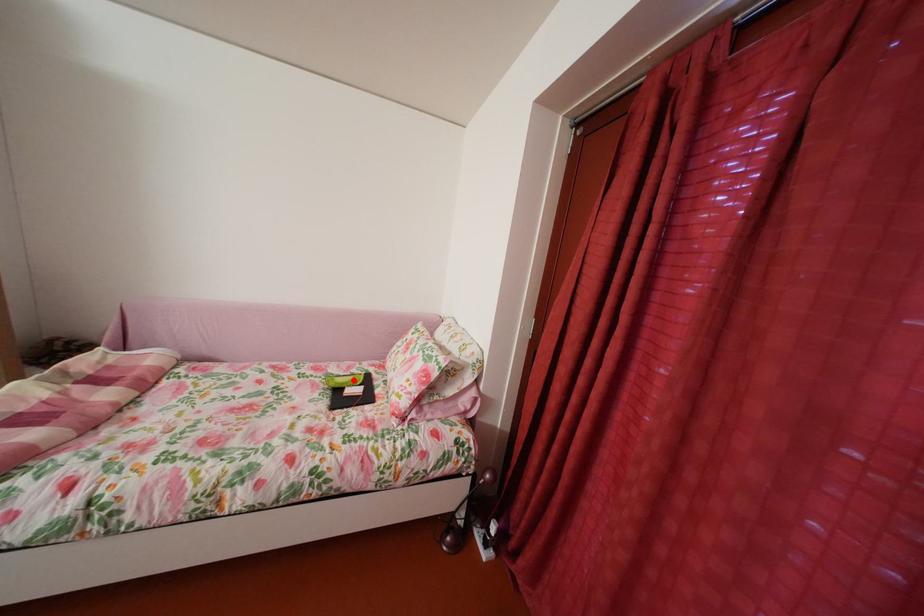
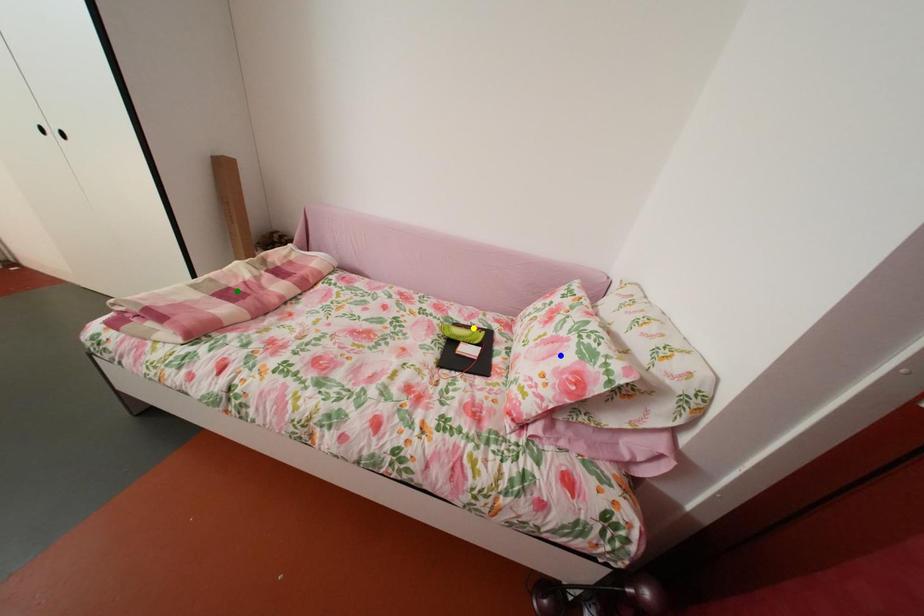
Question: I am providing you with two images of the same scene from different viewpoints. A red point is marked on the first image. You are given multiple points on the second image. Which mark in image 2 goes with the point in image 1?

Choices:
 (A) blue point
 (B) green point
 (C) yellow point

Answer: (C)